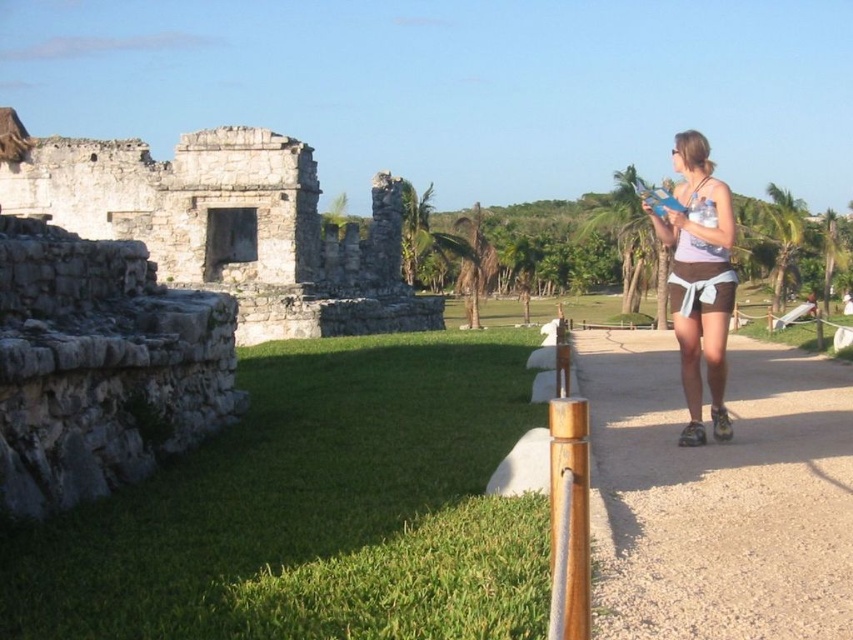
Question: Which object is positioned closest to the gray stone ruins at left?

Choices:
 (A) white fabric shorts at right
 (B) brown gravel path at center

Answer: (B)

Question: Which of these objects is positioned farthest from the brown gravel path at center?

Choices:
 (A) white fabric shorts at right
 (B) gray stone ruins at left

Answer: (B)

Question: Is gray stone ruins at left further to camera compared to white fabric shorts at right?

Choices:
 (A) no
 (B) yes

Answer: (B)

Question: Which is nearer to the brown gravel path at center?

Choices:
 (A) white fabric shorts at right
 (B) gray stone ruins at left

Answer: (A)

Question: Is brown gravel path at center wider than white fabric shorts at right?

Choices:
 (A) yes
 (B) no

Answer: (B)

Question: Is gray stone ruins at left below white fabric shorts at right?

Choices:
 (A) yes
 (B) no

Answer: (A)